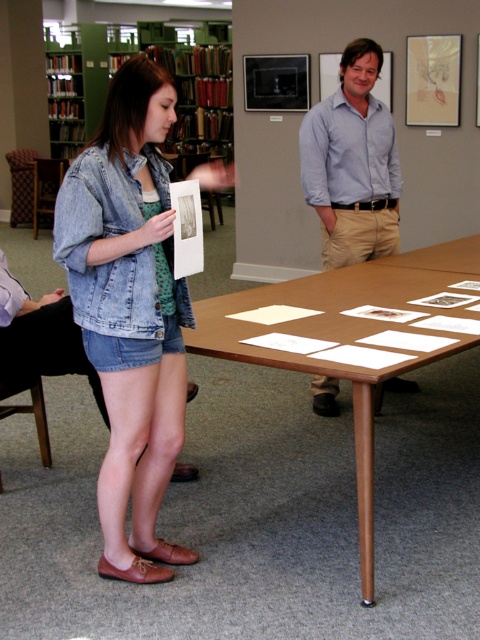
Question: Based on their relative distances, which object is farther from the denim jacket at center?

Choices:
 (A) green wood bookshelf at upper left
 (B) light blue shirt at center
 (C) brown wooden table at center

Answer: (A)

Question: Does light blue shirt at center appear on the left side of green wood bookshelf at upper left?

Choices:
 (A) yes
 (B) no

Answer: (B)

Question: Is denim jacket at center further to the viewer compared to light blue shirt at center?

Choices:
 (A) yes
 (B) no

Answer: (B)

Question: In this image, where is denim jacket at center located relative to brown wooden table at center?

Choices:
 (A) below
 (B) above

Answer: (A)

Question: Which point appears closest to the camera in this image?

Choices:
 (A) (312, 160)
 (B) (52, 250)
 (C) (63, 58)

Answer: (A)

Question: Which is farther from the denim jacket at center?

Choices:
 (A) green wood bookshelf at upper left
 (B) light blue shirt at center

Answer: (A)